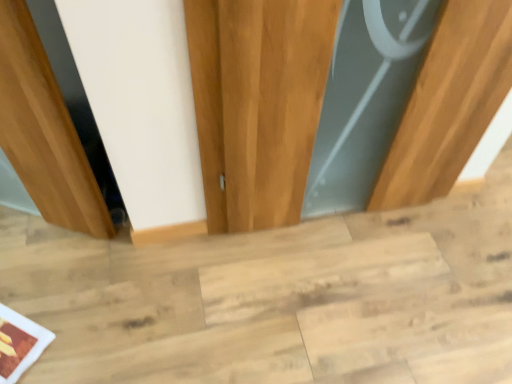
Question: From the image's perspective, is wooden door at center over light wood stair at center?

Choices:
 (A) no
 (B) yes

Answer: (B)

Question: From the image's perspective, does wooden door at center appear lower than light wood stair at center?

Choices:
 (A) yes
 (B) no

Answer: (B)

Question: Is wooden door at center facing away from light wood stair at center?

Choices:
 (A) no
 (B) yes

Answer: (A)

Question: From a real-world perspective, is wooden door at center over light wood stair at center?

Choices:
 (A) yes
 (B) no

Answer: (A)

Question: Is light wood stair at center a part of wooden door at center?

Choices:
 (A) yes
 (B) no

Answer: (B)

Question: Is wooden door at center at the right side of light wood stair at center?

Choices:
 (A) yes
 (B) no

Answer: (A)

Question: From the image's perspective, does light wood stair at center appear higher than wooden door at center?

Choices:
 (A) yes
 (B) no

Answer: (B)

Question: Would you consider light wood stair at center to be distant from wooden door at center?

Choices:
 (A) no
 (B) yes

Answer: (A)

Question: From a real-world perspective, does light wood stair at center stand above wooden door at center?

Choices:
 (A) yes
 (B) no

Answer: (B)

Question: Is light wood stair at center shorter than wooden door at center?

Choices:
 (A) yes
 (B) no

Answer: (A)

Question: From a real-world perspective, does light wood stair at center sit lower than wooden door at center?

Choices:
 (A) no
 (B) yes

Answer: (B)

Question: Is light wood stair at center at the right side of wooden door at center?

Choices:
 (A) no
 (B) yes

Answer: (A)

Question: Considering the positions of point (252, 188) and point (489, 203), is point (252, 188) closer or farther from the camera than point (489, 203)?

Choices:
 (A) closer
 (B) farther

Answer: (A)